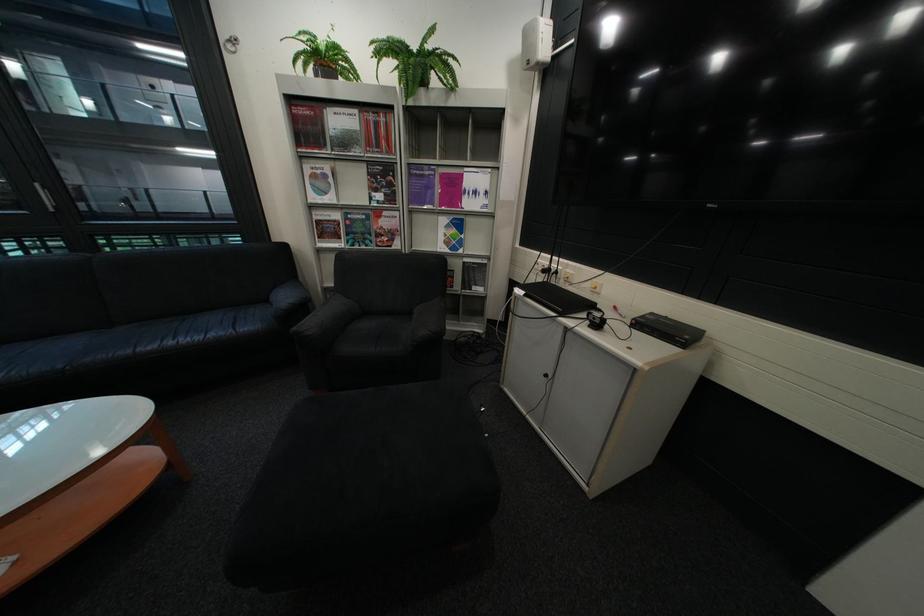
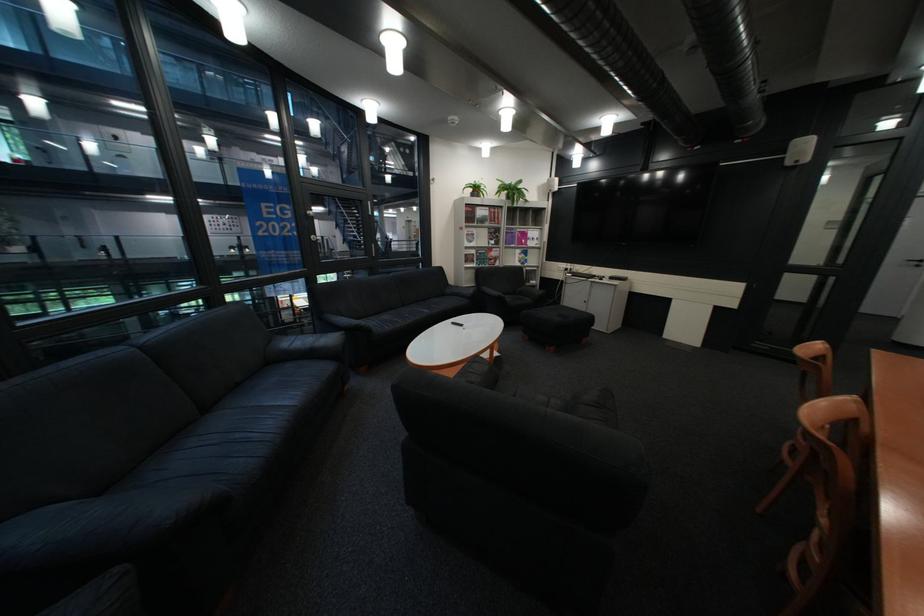
In the second image, find the point that corresponds to pixel 354 164 in the first image.

(492, 229)